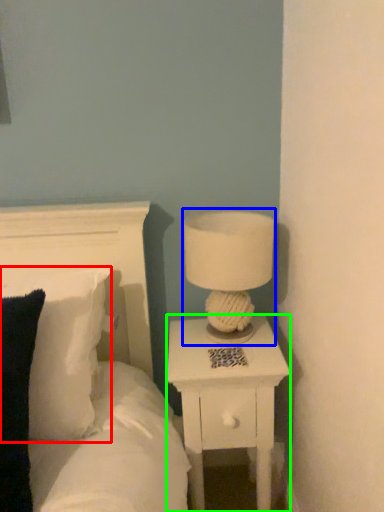
Question: Which object is positioned farthest from pillow (highlighted by a red box)? Select from table lamp (highlighted by a blue box) and nightstand (highlighted by a green box).

Choices:
 (A) table lamp
 (B) nightstand

Answer: (A)